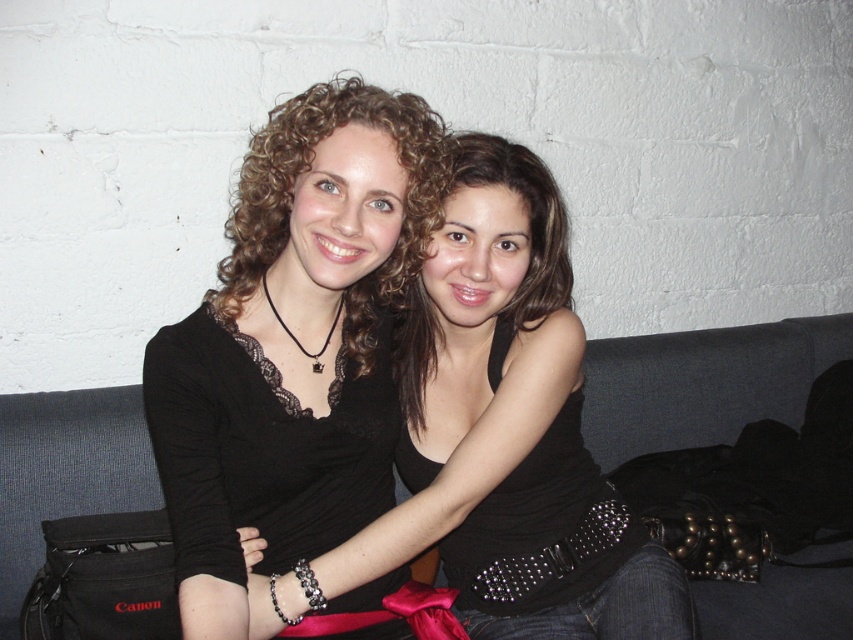
Between black studded belt at center and matte black tank top at center, which one has more height?

Standing taller between the two is black studded belt at center.

This screenshot has height=640, width=853. Describe the element at coordinates (543, 529) in the screenshot. I see `black studded belt at center` at that location.

Is point (544, 608) closer to camera compared to point (526, 179)?

No, it is behind (526, 179).

What are the coordinates of `black studded belt at center` in the screenshot? It's located at (543, 529).

From the picture: Who is more distant from viewer, (271, 464) or (492, 336)?

Positioned behind is point (492, 336).

Where is `black lace dress at center`? This screenshot has width=853, height=640. black lace dress at center is located at coordinates (264, 448).

Which is behind, point (842, 579) or point (376, 109)?

Point (842, 579)

Can you confirm if dark gray fabric couch at center is wider than matte black top at center?

Yes, dark gray fabric couch at center is wider than matte black top at center.

This screenshot has width=853, height=640. What do you see at coordinates (703, 384) in the screenshot?
I see `dark gray fabric couch at center` at bounding box center [703, 384].

Locate an element on the screen. This screenshot has height=640, width=853. dark gray fabric couch at center is located at coordinates (703, 384).